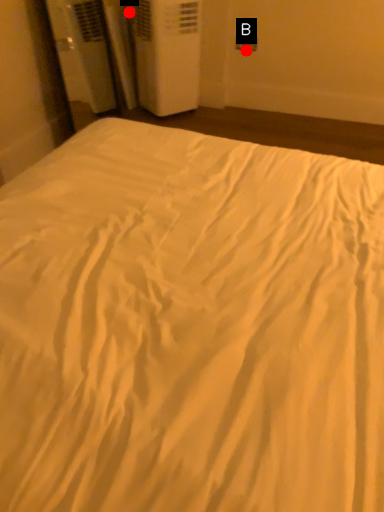
Question: Two points are circled on the image, labeled by A and B beside each circle. Which point is further to the camera?

Choices:
 (A) A is further
 (B) B is further

Answer: (B)